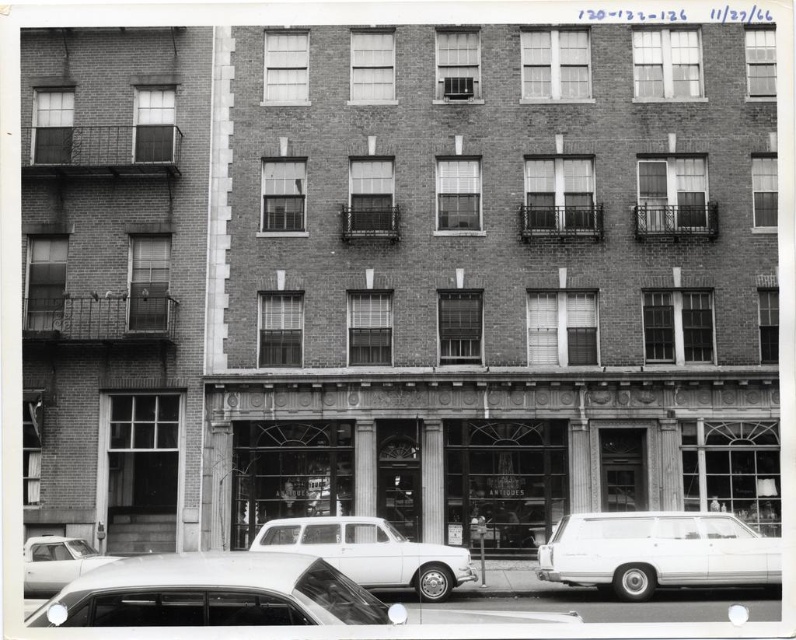
Question: Based on their relative distances, which object is farther from the white matte station wagon at center?

Choices:
 (A) white matte sedan at lower left
 (B) white glossy station wagon at lower right

Answer: (B)

Question: Which object is closer to the camera taking this photo?

Choices:
 (A) white matte station wagon at center
 (B) white matte sedan at lower left

Answer: (A)

Question: Which object is farther from the camera taking this photo?

Choices:
 (A) shiny silver sedan at lower left
 (B) white matte station wagon at center

Answer: (B)

Question: Is shiny silver sedan at lower left bigger than white matte station wagon at center?

Choices:
 (A) no
 (B) yes

Answer: (B)

Question: Does white matte station wagon at center appear on the left side of white matte sedan at lower left?

Choices:
 (A) yes
 (B) no

Answer: (B)

Question: Is shiny silver sedan at lower left positioned in front of white matte station wagon at center?

Choices:
 (A) yes
 (B) no

Answer: (A)